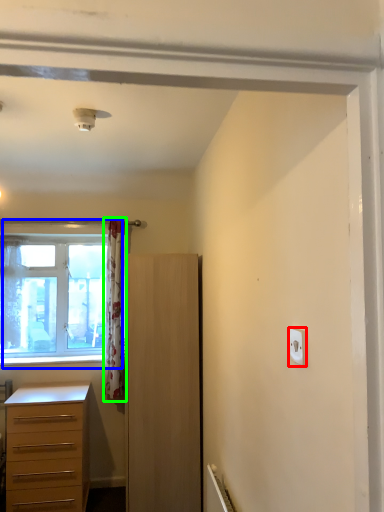
Question: Which object is the farthest from light switch (highlighted by a red box)? Choose among these: window (highlighted by a blue box) or curtain (highlighted by a green box).

Choices:
 (A) window
 (B) curtain

Answer: (A)